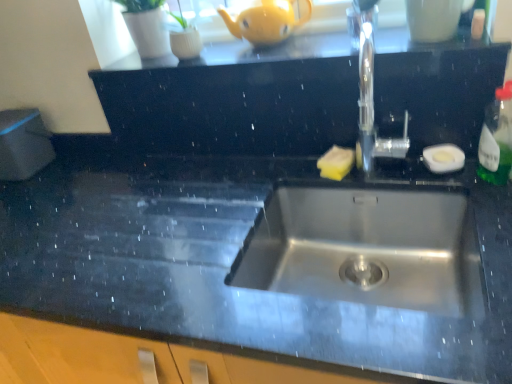
Question: Is green translucent bottle at right wider or thinner than white glossy mug at upper center?

Choices:
 (A) wide
 (B) thin

Answer: (B)

Question: Is green translucent bottle at right to the left or to the right of white glossy mug at upper center in the image?

Choices:
 (A) left
 (B) right

Answer: (B)

Question: Based on their relative distances, which object is nearer to the polished stainless steel tap at upper center?

Choices:
 (A) black granite dresser at center
 (B) yellow matte teapot at upper center
 (C) white glossy mug at upper center
 (D) green translucent bottle at right

Answer: (C)

Question: Which of these objects is positioned farthest from the polished stainless steel tap at upper center?

Choices:
 (A) black granite dresser at center
 (B) yellow matte teapot at upper center
 (C) white glossy mug at upper center
 (D) green translucent bottle at right

Answer: (B)